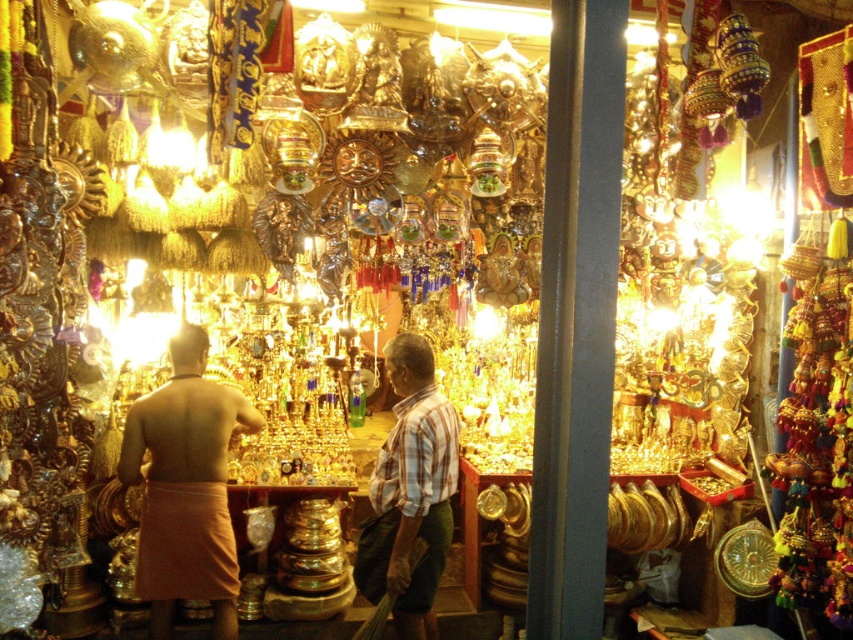
Question: Observing the image, what is the correct spatial positioning of orange fabric cloth at center in reference to plaid fabric shirt at center?

Choices:
 (A) right
 (B) left

Answer: (B)

Question: Which point is farther from the camera taking this photo?

Choices:
 (A) (432, 504)
 (B) (231, 556)

Answer: (B)

Question: In this image, where is orange fabric cloth at center located relative to plaid fabric shirt at center?

Choices:
 (A) below
 (B) above

Answer: (B)

Question: Observing the image, what is the correct spatial positioning of orange fabric cloth at center in reference to plaid fabric shirt at center?

Choices:
 (A) right
 (B) left

Answer: (B)